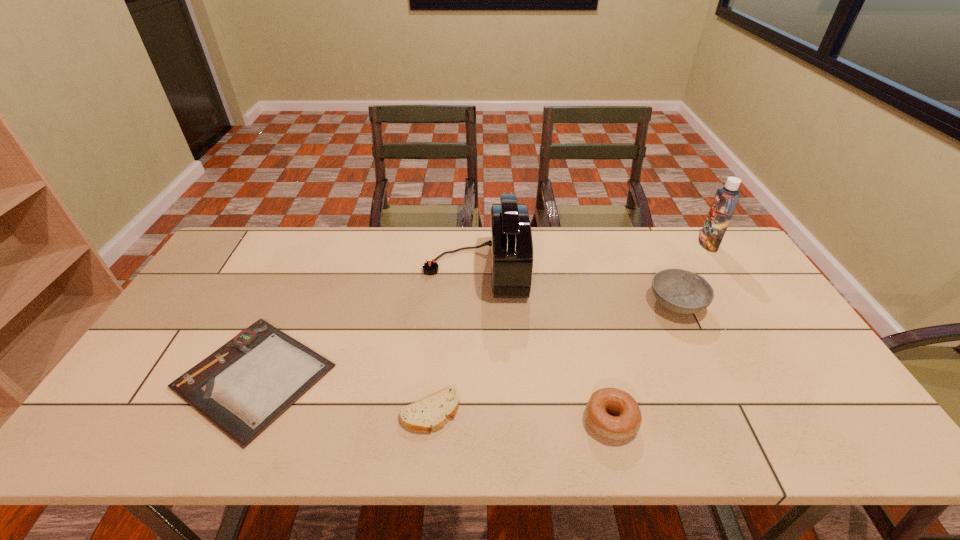
Where is `free space located 0.140m on the front label of the rightmost object`? free space located 0.140m on the front label of the rightmost object is located at coordinates (660, 244).

Where is `vacant area located on the front label of the rightmost object`? The height and width of the screenshot is (540, 960). vacant area located on the front label of the rightmost object is located at coordinates (683, 244).

Find the location of a particular element. Image resolution: width=960 pixels, height=540 pixels. free space located on the front-facing side of the radio receiver is located at coordinates (612, 269).

The height and width of the screenshot is (540, 960). I want to click on vacant space located on the left of the second object from right to left, so click(x=564, y=303).

You are a GUI agent. You are given a task and a screenshot of the screen. Output one action in this format:
    pyautogui.click(x=<x>, y=<y>)
    Task: Click on the free spot located on the back of the bagel
    The width and height of the screenshot is (960, 540).
    Given the screenshot: What is the action you would take?
    tap(600, 377)

At what (x,y) coordinates should I click in order to perform the action: click on vacant region located 0.370m on the back of the second shortest object. Please return your answer as a coordinate pair (x, y). The width and height of the screenshot is (960, 540). Looking at the image, I should click on (x=442, y=289).

At what (x,y) coordinates should I click in order to perform the action: click on vacant area situated on the left of the shortest object. Please return your answer as a coordinate pair (x, y). Looking at the image, I should click on (148, 376).

This screenshot has width=960, height=540. Identify the location of shampoo at the far edge. (726, 199).

In order to click on radio receiver that is at the far edge in this screenshot , I will do `click(511, 246)`.

Image resolution: width=960 pixels, height=540 pixels. In order to click on bagel located at the near edge in this screenshot , I will do `click(626, 423)`.